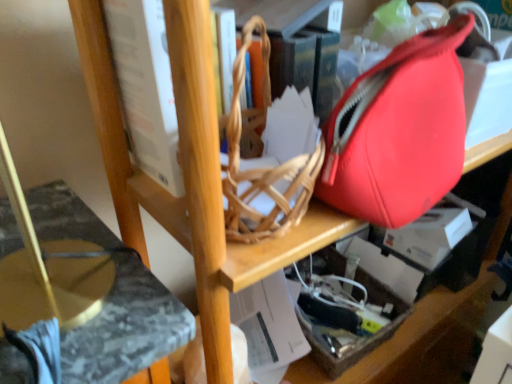
Question: Does translucent plastic box at lower right have a greater width compared to marble-patterned swivel chair at lower left?

Choices:
 (A) no
 (B) yes

Answer: (A)

Question: Is translucent plastic box at lower right surrounding marble-patterned swivel chair at lower left?

Choices:
 (A) yes
 (B) no

Answer: (B)

Question: Does translucent plastic box at lower right lie in front of marble-patterned swivel chair at lower left?

Choices:
 (A) yes
 (B) no

Answer: (B)

Question: Is translucent plastic box at lower right facing towards marble-patterned swivel chair at lower left?

Choices:
 (A) no
 (B) yes

Answer: (A)

Question: From the image's perspective, does translucent plastic box at lower right appear higher than marble-patterned swivel chair at lower left?

Choices:
 (A) no
 (B) yes

Answer: (A)

Question: From a real-world perspective, is white paperboard book at upper center physically located above or below marble-patterned swivel chair at lower left?

Choices:
 (A) above
 (B) below

Answer: (A)

Question: Relative to marble-patterned swivel chair at lower left, is white paperboard book at upper center in front or behind?

Choices:
 (A) behind
 (B) front

Answer: (A)

Question: From the image's perspective, is white paperboard book at upper center above or below marble-patterned swivel chair at lower left?

Choices:
 (A) above
 (B) below

Answer: (A)

Question: In terms of height, does white paperboard book at upper center look taller or shorter compared to marble-patterned swivel chair at lower left?

Choices:
 (A) short
 (B) tall

Answer: (A)

Question: Is white paperboard book at upper center inside the boundaries of matte red tote bag at right, or outside?

Choices:
 (A) inside
 (B) outside

Answer: (B)

Question: Would you say white paperboard book at upper center is to the left or to the right of matte red tote bag at right in the picture?

Choices:
 (A) left
 (B) right

Answer: (A)

Question: Considering their positions, is white paperboard book at upper center located in front of or behind matte red tote bag at right?

Choices:
 (A) front
 (B) behind

Answer: (B)

Question: Considering the positions of white paperboard book at upper center and matte red tote bag at right in the image, is white paperboard book at upper center bigger or smaller than matte red tote bag at right?

Choices:
 (A) small
 (B) big

Answer: (B)

Question: From the image's perspective, is marble-patterned swivel chair at lower left located above or below translucent plastic box at lower right?

Choices:
 (A) above
 (B) below

Answer: (A)

Question: Considering the positions of point (118, 342) and point (328, 251), is point (118, 342) closer or farther from the camera than point (328, 251)?

Choices:
 (A) closer
 (B) farther

Answer: (A)